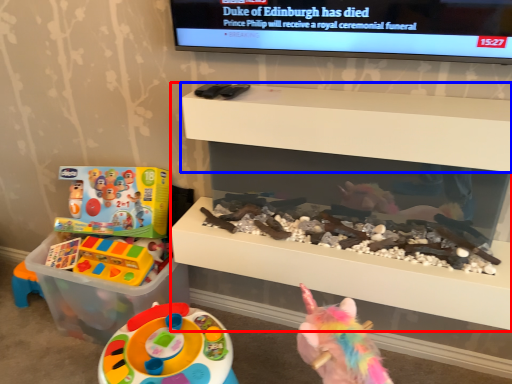
Question: Which object is closer to the camera taking this photo, shelf (highlighted by a red box) or shelf (highlighted by a blue box)?

Choices:
 (A) shelf
 (B) shelf

Answer: (B)